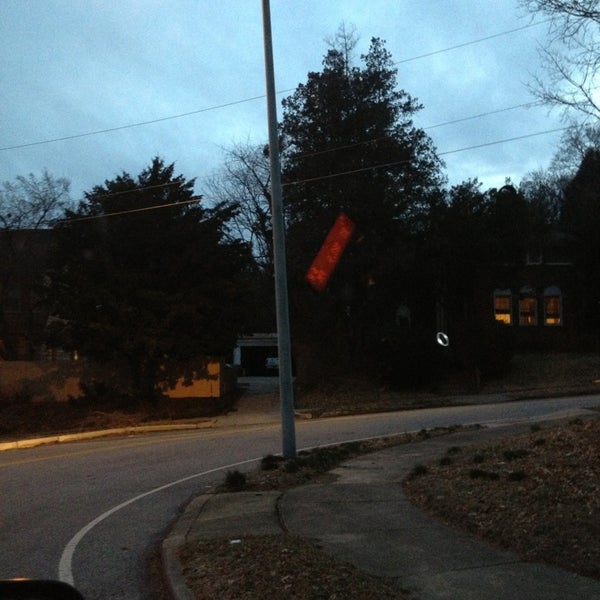
Locate an element on the screen. The width and height of the screenshot is (600, 600). window is located at coordinates (504, 304), (536, 258), (558, 261), (552, 303), (528, 306).